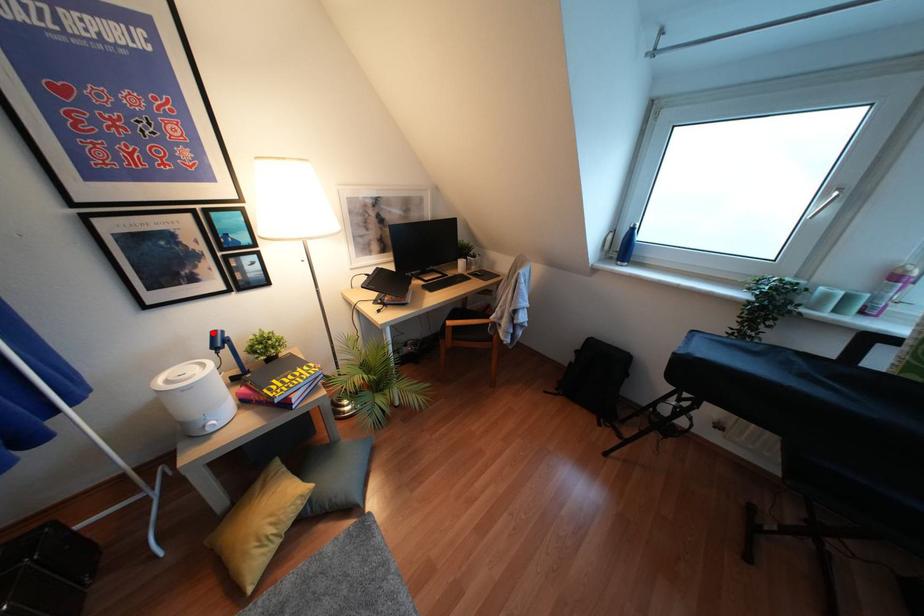
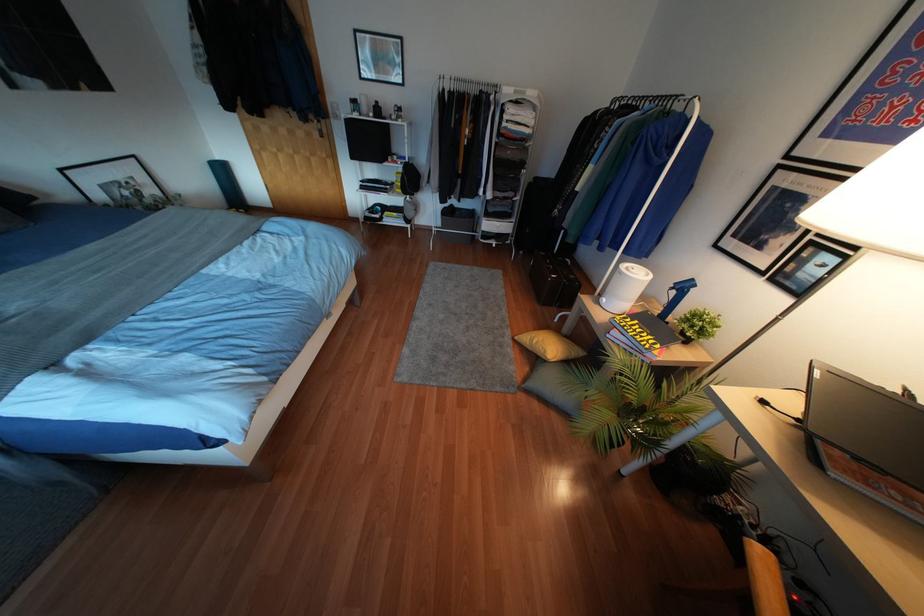
Question: I am providing you with two images of the same scene from different viewpoints. A red point is shown in image1. For the corresponding object point in image2, is it positioned nearer or farther from the camera?

Choices:
 (A) Nearer
 (B) Farther

Answer: (A)